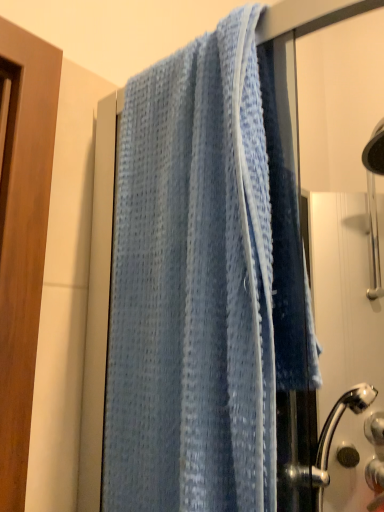
Identify the location of satin silver knob at lower right, which appears as the first knob when viewed from the right. (375, 428).

Image resolution: width=384 pixels, height=512 pixels. In order to click on blue fabric towel at right in this screenshot , I will do `click(345, 333)`.

What are the coordinates of `satin silver knob at lower right, positioned as the second knob in left-to-right order` in the screenshot? It's located at (x=375, y=428).

Would you say matte black knob at lower right, acting as the second knob starting from the right, is outside blue fabric towel at right?

matte black knob at lower right, acting as the second knob starting from the right, is positioned outside blue fabric towel at right.

Considering the sizes of objects matte black knob at lower right, the first knob viewed from the left, and blue fabric towel at right in the image provided, who is shorter, matte black knob at lower right, the first knob viewed from the left, or blue fabric towel at right?

Standing shorter between the two is matte black knob at lower right, the first knob viewed from the left.

Which is nearer, (359, 458) or (383, 220)?

Positioned in front is point (359, 458).

Is matte black knob at lower right, acting as the second knob starting from the right, at the left side of blue fabric towel at right?

Incorrect, matte black knob at lower right, acting as the second knob starting from the right, is not on the left side of blue fabric towel at right.

From the image's perspective, does blue fabric towel at right appear higher than satin silver knob at lower right, positioned as the second knob in left-to-right order?

Correct, blue fabric towel at right appears higher than satin silver knob at lower right, positioned as the second knob in left-to-right order, in the image.

From a real-world perspective, is blue fabric towel at right on top of satin silver knob at lower right, positioned as the second knob in left-to-right order?

Indeed, from a real-world perspective, blue fabric towel at right stands above satin silver knob at lower right, positioned as the second knob in left-to-right order.

Identify the location of knob that is in front of the matte black knob at lower right, the first knob viewed from the left. This screenshot has height=512, width=384. (375, 428).

Is satin silver knob at lower right, positioned as the second knob in left-to-right order, thinner than matte black knob at lower right, acting as the second knob starting from the right?

Incorrect, the width of satin silver knob at lower right, positioned as the second knob in left-to-right order, is not less than that of matte black knob at lower right, acting as the second knob starting from the right.

Is satin silver knob at lower right, positioned as the second knob in left-to-right order, not close to matte black knob at lower right, acting as the second knob starting from the right?

satin silver knob at lower right, positioned as the second knob in left-to-right order, is near matte black knob at lower right, acting as the second knob starting from the right, not far away.

From the image's perspective, which is below, satin silver knob at lower right, which appears as the first knob when viewed from the right, or matte black knob at lower right, the first knob viewed from the left?

matte black knob at lower right, the first knob viewed from the left, is shown below in the image.

Is point (379, 436) positioned after point (206, 447)?

Yes.

Can you tell me how much satin silver knob at lower right, positioned as the second knob in left-to-right order, and light blue waffle-textured towel at center differ in facing direction?

They differ by 41.7 degrees in their facing directions.

Which of these two, satin silver knob at lower right, positioned as the second knob in left-to-right order, or light blue waffle-textured towel at center, is thinner?

Thinner between the two is satin silver knob at lower right, positioned as the second knob in left-to-right order.

Is the depth of satin silver knob at lower right, positioned as the second knob in left-to-right order, greater than that of light blue waffle-textured towel at center?

Yes, satin silver knob at lower right, positioned as the second knob in left-to-right order, is further from the camera.

Is light blue waffle-textured towel at center facing away from satin silver knob at lower right, positioned as the second knob in left-to-right order?

That's right, light blue waffle-textured towel at center is facing away from satin silver knob at lower right, positioned as the second knob in left-to-right order.

Is light blue waffle-textured towel at center taller than satin silver knob at lower right, positioned as the second knob in left-to-right order?

Indeed, light blue waffle-textured towel at center has a greater height compared to satin silver knob at lower right, positioned as the second knob in left-to-right order.

Does point (287, 216) come behind point (366, 431)?

That is False.

Measure the distance from light blue waffle-textured towel at center to matte black knob at lower right, the first knob viewed from the left.

A distance of 29.88 inches exists between light blue waffle-textured towel at center and matte black knob at lower right, the first knob viewed from the left.

Are light blue waffle-textured towel at center and matte black knob at lower right, the first knob viewed from the left, located far from each other?

No, there isn't a large distance between light blue waffle-textured towel at center and matte black knob at lower right, the first knob viewed from the left.

Which of these two, light blue waffle-textured towel at center or matte black knob at lower right, the first knob viewed from the left, stands shorter?

matte black knob at lower right, the first knob viewed from the left, is shorter.

Is light blue waffle-textured towel at center to the right of matte black knob at lower right, the first knob viewed from the left, from the viewer's perspective?

No.

Which is closer, (373, 371) or (346, 449)?

Point (373, 371).

Between blue fabric towel at right and matte black knob at lower right, acting as the second knob starting from the right, which one has less height?

matte black knob at lower right, acting as the second knob starting from the right, is shorter.

Considering the sizes of objects blue fabric towel at right and matte black knob at lower right, the first knob viewed from the left, in the image provided, who is wider, blue fabric towel at right or matte black knob at lower right, the first knob viewed from the left,?

Wider between the two is blue fabric towel at right.

From the image's perspective, is blue fabric towel at right located above or below matte black knob at lower right, the first knob viewed from the left?

Based on their image positions, blue fabric towel at right is located above matte black knob at lower right, the first knob viewed from the left.

In order to click on screen door that appears above the matte black knob at lower right, acting as the second knob starting from the right (from a real-world perspective) in this screenshot , I will do `click(345, 333)`.

The image size is (384, 512). What are the coordinates of `screen door on the left of the satin silver knob at lower right, which appears as the first knob when viewed from the right` in the screenshot? It's located at (345, 333).

Looking at the image, which one is located closer to satin silver knob at lower right, which appears as the first knob when viewed from the right, matte black knob at lower right, the first knob viewed from the left, or blue fabric towel at right?

matte black knob at lower right, the first knob viewed from the left, is positioned closer to the anchor satin silver knob at lower right, which appears as the first knob when viewed from the right.

Which object lies further to the anchor point matte black knob at lower right, the first knob viewed from the left, blue fabric towel at right or light blue waffle-textured towel at center?

Among the two, light blue waffle-textured towel at center is located further to matte black knob at lower right, the first knob viewed from the left.

From the picture: Looking at the image, which one is located further to light blue waffle-textured towel at center, matte black knob at lower right, acting as the second knob starting from the right, or blue fabric towel at right?

matte black knob at lower right, acting as the second knob starting from the right, lies further to light blue waffle-textured towel at center than the other object.

Looking at the image, which one is located closer to matte black knob at lower right, the first knob viewed from the left, satin silver knob at lower right, positioned as the second knob in left-to-right order, or blue fabric towel at right?

The object closer to matte black knob at lower right, the first knob viewed from the left, is satin silver knob at lower right, positioned as the second knob in left-to-right order.

Looking at the image, which one is located closer to light blue waffle-textured towel at center, satin silver knob at lower right, which appears as the first knob when viewed from the right, or blue fabric towel at right?

The object closer to light blue waffle-textured towel at center is blue fabric towel at right.

Based on their spatial positions, is matte black knob at lower right, the first knob viewed from the left, or light blue waffle-textured towel at center further from satin silver knob at lower right, which appears as the first knob when viewed from the right?

light blue waffle-textured towel at center is positioned further to the anchor satin silver knob at lower right, which appears as the first knob when viewed from the right.

Based on their spatial positions, is blue fabric towel at right or light blue waffle-textured towel at center closer to satin silver knob at lower right, positioned as the second knob in left-to-right order?

blue fabric towel at right is positioned closer to the anchor satin silver knob at lower right, positioned as the second knob in left-to-right order.

Considering their positions, is blue fabric towel at right positioned closer to satin silver knob at lower right, which appears as the first knob when viewed from the right, than matte black knob at lower right, the first knob viewed from the left?

Among the two, matte black knob at lower right, the first knob viewed from the left, is located nearer to satin silver knob at lower right, which appears as the first knob when viewed from the right.

You are a GUI agent. You are given a task and a screenshot of the screen. Output one action in this format:
    pyautogui.click(x=<x>, y=<y>)
    Task: Click on the knob located between blue fabric towel at right and matte black knob at lower right, the first knob viewed from the left, in the depth direction
    The width and height of the screenshot is (384, 512).
    Given the screenshot: What is the action you would take?
    pyautogui.click(x=375, y=428)

What are the coordinates of `screen door between light blue waffle-textured towel at center and matte black knob at lower right, acting as the second knob starting from the right, along the z-axis` in the screenshot? It's located at (345, 333).

The image size is (384, 512). Find the location of `screen door positioned between light blue waffle-textured towel at center and satin silver knob at lower right, positioned as the second knob in left-to-right order, from near to far`. screen door positioned between light blue waffle-textured towel at center and satin silver knob at lower right, positioned as the second knob in left-to-right order, from near to far is located at coordinates (345, 333).

The image size is (384, 512). I want to click on knob located between light blue waffle-textured towel at center and matte black knob at lower right, the first knob viewed from the left, in the depth direction, so click(x=375, y=428).